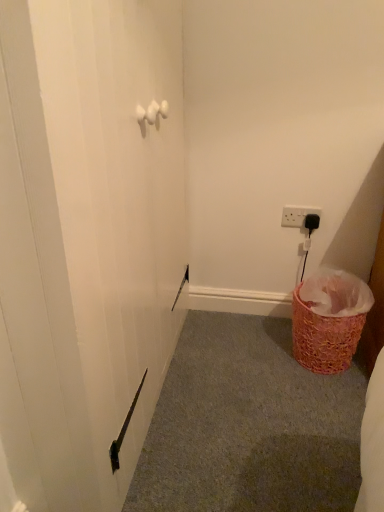
Find the location of a particular element. The image size is (384, 512). pink woven basket at lower right is located at coordinates (249, 425).

Locate an element on the screen. This screenshot has width=384, height=512. white plastic electric outlet at upper right is located at coordinates (297, 215).

Considering the sizes of objects pink woven basket at lower right and white plastic electric outlet at upper right in the image provided, who is taller, pink woven basket at lower right or white plastic electric outlet at upper right?

white plastic electric outlet at upper right is taller.

In the image, is pink woven basket at lower right on the left side or the right side of white plastic electric outlet at upper right?

Based on their positions, pink woven basket at lower right is located to the left of white plastic electric outlet at upper right.

Which is in front, point (227, 345) or point (302, 219)?

Positioned in front is point (227, 345).

Does pink woven basket at lower right have a greater width compared to white plastic electric outlet at upper right?

Indeed, pink woven basket at lower right has a greater width compared to white plastic electric outlet at upper right.

You are a GUI agent. You are given a task and a screenshot of the screen. Output one action in this format:
    pyautogui.click(x=<x>, y=<y>)
    Task: Click on the basket above the pink woven basket at lower right (from a real-world perspective)
    The height and width of the screenshot is (512, 384).
    Given the screenshot: What is the action you would take?
    pyautogui.click(x=329, y=320)

From a real-world perspective, which object stands above the other?

In real-world perspective, ruffled pink basket at lower right is above.

Considering the relative sizes of pink woven basket at lower right and ruffled pink basket at lower right in the image provided, is pink woven basket at lower right smaller than ruffled pink basket at lower right?

Indeed, pink woven basket at lower right has a smaller size compared to ruffled pink basket at lower right.

Does point (328, 393) come farther from viewer compared to point (372, 305)?

No, (328, 393) is in front of (372, 305).

From a real-world perspective, is ruffled pink basket at lower right physically located above or below white plastic electric outlet at upper right?

ruffled pink basket at lower right is below white plastic electric outlet at upper right.

How many degrees apart are the facing directions of ruffled pink basket at lower right and white plastic electric outlet at upper right?

The angular difference between ruffled pink basket at lower right and white plastic electric outlet at upper right is 1.43 degrees.

Is ruffled pink basket at lower right oriented towards white plastic electric outlet at upper right?

No, ruffled pink basket at lower right is not aimed at white plastic electric outlet at upper right.

From the picture: Does ruffled pink basket at lower right have a lesser width compared to white plastic electric outlet at upper right?

Incorrect, the width of ruffled pink basket at lower right is not less than that of white plastic electric outlet at upper right.

From the image's perspective, is white plastic electric outlet at upper right under pink woven basket at lower right?

No, from the image's perspective, white plastic electric outlet at upper right is not beneath pink woven basket at lower right.

Is white plastic electric outlet at upper right wider or thinner than pink woven basket at lower right?

In the image, white plastic electric outlet at upper right appears to be more narrow than pink woven basket at lower right.

From a real-world perspective, who is located lower, white plastic electric outlet at upper right or pink woven basket at lower right?

pink woven basket at lower right, from a real-world perspective.

Is white plastic electric outlet at upper right bigger than pink woven basket at lower right?

No.

How many degrees apart are the facing directions of white plastic electric outlet at upper right and ruffled pink basket at lower right?

1.43 degrees separate the facing orientations of white plastic electric outlet at upper right and ruffled pink basket at lower right.

Between white plastic electric outlet at upper right and ruffled pink basket at lower right, which one is positioned behind?

white plastic electric outlet at upper right is further from the camera.

In terms of height, does white plastic electric outlet at upper right look taller or shorter compared to ruffled pink basket at lower right?

Considering their sizes, white plastic electric outlet at upper right has less height than ruffled pink basket at lower right.

Considering the sizes of objects white plastic electric outlet at upper right and ruffled pink basket at lower right in the image provided, who is bigger, white plastic electric outlet at upper right or ruffled pink basket at lower right?

With larger size is ruffled pink basket at lower right.

In the image, is ruffled pink basket at lower right positioned in front of or behind pink woven basket at lower right?

ruffled pink basket at lower right is positioned farther from the viewer than pink woven basket at lower right.

Is ruffled pink basket at lower right next to pink woven basket at lower right and touching it?

ruffled pink basket at lower right is not next to pink woven basket at lower right, and they're not touching.

How far apart are ruffled pink basket at lower right and pink woven basket at lower right?

They are 10.95 inches apart.

Is ruffled pink basket at lower right outside of pink woven basket at lower right?

Yes, ruffled pink basket at lower right is not within pink woven basket at lower right.

Image resolution: width=384 pixels, height=512 pixels. I want to click on plain below the white plastic electric outlet at upper right (from the image's perspective), so click(249, 425).

This screenshot has height=512, width=384. Identify the location of plain that appears on the left of ruffled pink basket at lower right. (249, 425).

Looking at the image, which one is located further to ruffled pink basket at lower right, white plastic electric outlet at upper right or pink woven basket at lower right?

Based on the image, white plastic electric outlet at upper right appears to be further to ruffled pink basket at lower right.

Consider the image. Which object lies nearer to the anchor point pink woven basket at lower right, ruffled pink basket at lower right or white plastic electric outlet at upper right?

ruffled pink basket at lower right.

Based on their spatial positions, is pink woven basket at lower right or ruffled pink basket at lower right further from white plastic electric outlet at upper right?

pink woven basket at lower right is further to white plastic electric outlet at upper right.

Based on the photo, based on their spatial positions, is white plastic electric outlet at upper right or ruffled pink basket at lower right closer to pink woven basket at lower right?

ruffled pink basket at lower right.

Which object lies nearer to the anchor point white plastic electric outlet at upper right, ruffled pink basket at lower right or pink woven basket at lower right?

Among the two, ruffled pink basket at lower right is located nearer to white plastic electric outlet at upper right.

Considering their positions, is pink woven basket at lower right positioned closer to ruffled pink basket at lower right than white plastic electric outlet at upper right?

The object closer to ruffled pink basket at lower right is pink woven basket at lower right.

This screenshot has height=512, width=384. What are the coordinates of `basket between pink woven basket at lower right and white plastic electric outlet at upper right in the front-back direction` in the screenshot? It's located at (x=329, y=320).